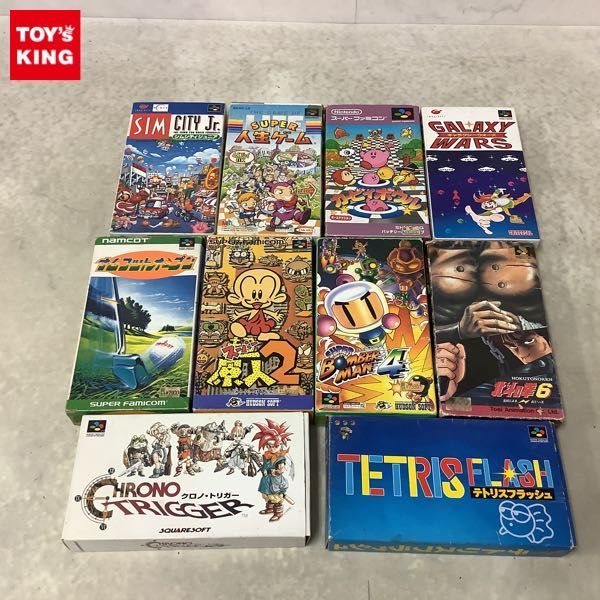
Locate an element on the screen. Image resolution: width=600 pixels, height=600 pixels. video game cases is located at coordinates (139, 277), (276, 295), (348, 301), (460, 315), (485, 186), (342, 166), (258, 166), (155, 163), (235, 475), (462, 505).